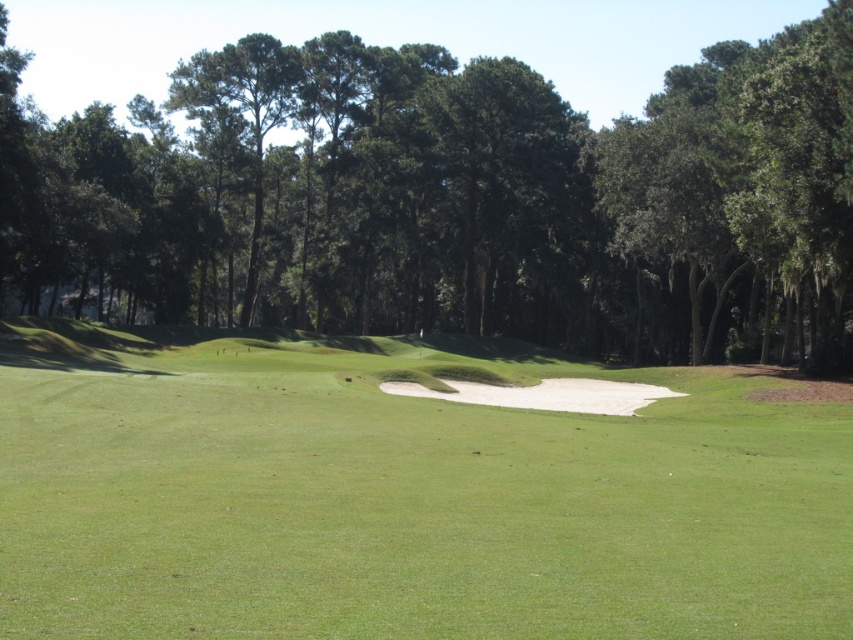
Question: Which object appears farthest from the camera in this image?

Choices:
 (A) green leafy tree at center
 (B) green grassy golf course at center

Answer: (A)

Question: Which point is closer to the camera?

Choices:
 (A) (843, 147)
 (B) (850, 413)

Answer: (B)

Question: Does green grassy golf course at center appear under green leafy tree at center?

Choices:
 (A) no
 (B) yes

Answer: (B)

Question: Is green grassy golf course at center below green leafy tree at center?

Choices:
 (A) no
 (B) yes

Answer: (B)

Question: From the image, what is the correct spatial relationship of green grassy golf course at center in relation to green leafy tree at center?

Choices:
 (A) above
 (B) below

Answer: (B)